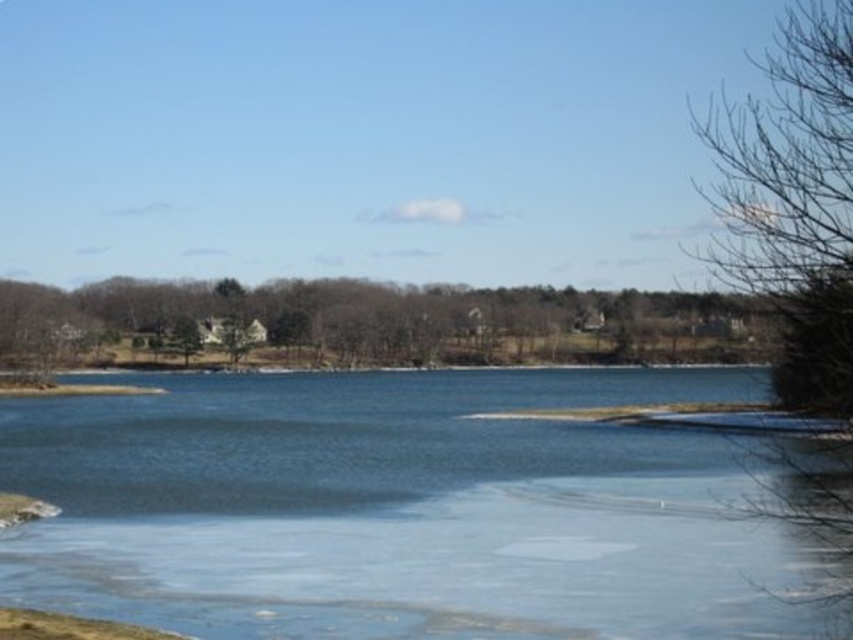
Question: Is brown textured tree at center positioned at the back of bare branches at right?

Choices:
 (A) yes
 (B) no

Answer: (A)

Question: Considering the relative positions of bare branches at right and green matte tree at center in the image provided, where is bare branches at right located with respect to green matte tree at center?

Choices:
 (A) above
 (B) below

Answer: (A)

Question: Which of the following is the farthest from the observer?

Choices:
 (A) green matte tree at center
 (B) clear ice at center

Answer: (A)

Question: Which of the following is the farthest from the observer?

Choices:
 (A) clear ice at center
 (B) brown textured tree at center

Answer: (A)

Question: Can you confirm if brown textured tree at center is wider than bare branches at right?

Choices:
 (A) no
 (B) yes

Answer: (B)

Question: Estimate the real-world distances between objects in this image. Which object is closer to the bare branches at right?

Choices:
 (A) clear ice at center
 (B) brown textured tree at center

Answer: (A)